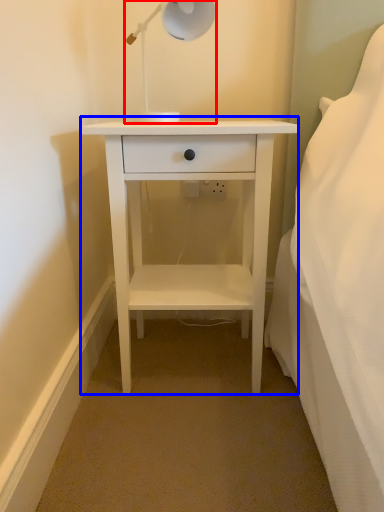
Question: Which point is closer to the camera, lamp (highlighted by a red box) or nightstand (highlighted by a blue box)?

Choices:
 (A) lamp
 (B) nightstand

Answer: (A)